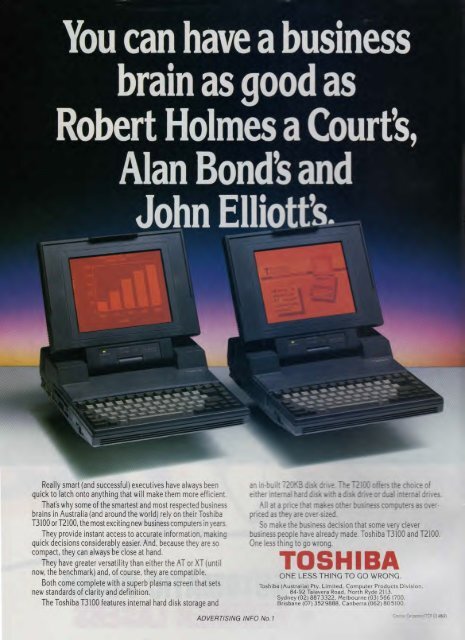
Identify the location of green power indicator lights oon each computer. (293, 342), (103, 354).